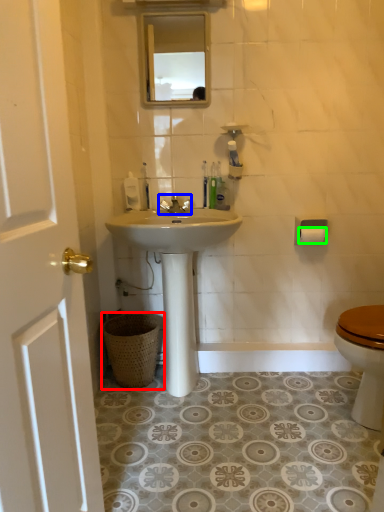
Question: Which object is the closest to the trash bin/can (highlighted by a red box)? Choose among these: faucet (highlighted by a blue box) or toilet paper (highlighted by a green box).

Choices:
 (A) faucet
 (B) toilet paper

Answer: (A)